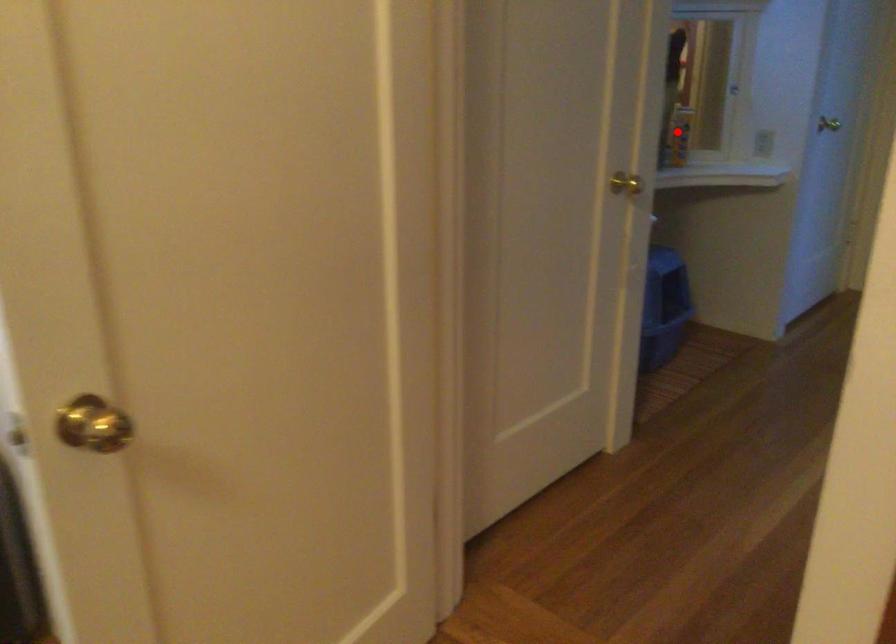
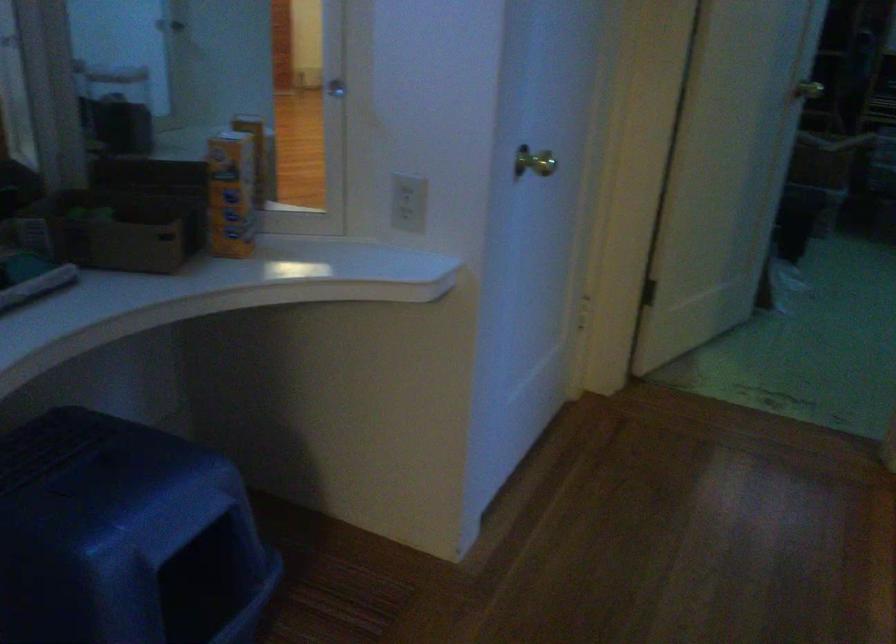
Question: I am providing you with two images of the same scene from different viewpoints. A red point is shown in image1. For the corresponding object point in image2, is it positioned nearer or farther from the camera?

Choices:
 (A) Nearer
 (B) Farther

Answer: (A)